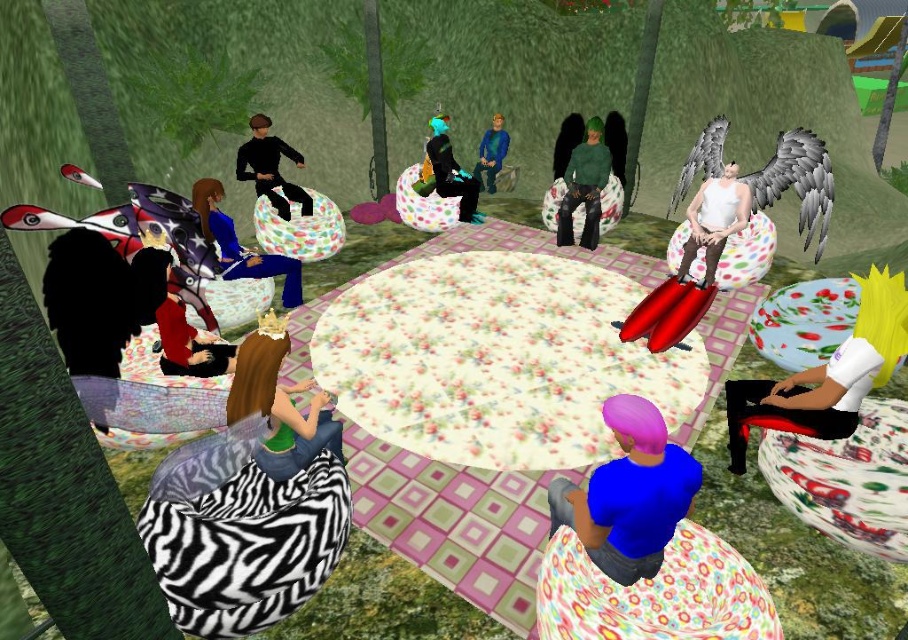
Question: Does matte blue shirt at center left appear on the left side of black matte clothing at center?

Choices:
 (A) yes
 (B) no

Answer: (B)

Question: Among these points, which one is nearest to the camera?

Choices:
 (A) (438, 160)
 (B) (601, 468)
 (C) (767, 417)
 (D) (392, 280)

Answer: (B)

Question: Which point is farther to the camera?

Choices:
 (A) floral fabric table at center
 (B) yellow spiky hair at lower right
 (C) green fabric dress at center
 (D) matte blue shirt at center left

Answer: (D)

Question: Is floral fabric table at center to the left of matte black pants at center from the viewer's perspective?

Choices:
 (A) yes
 (B) no

Answer: (B)

Question: Which point appears closest to the camera in this image?

Choices:
 (A) (682, 260)
 (B) (275, 275)
 (C) (445, 150)

Answer: (A)

Question: Is the position of floral fabric table at center less distant than that of blue matte shirt at center?

Choices:
 (A) no
 (B) yes

Answer: (B)